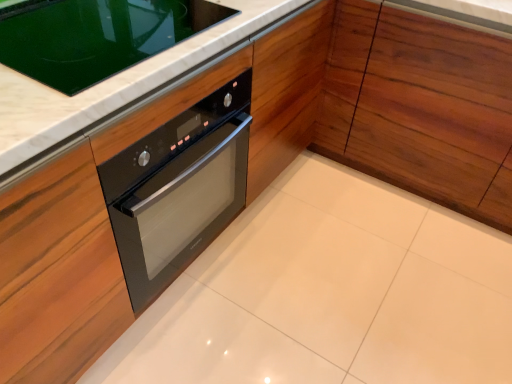
Question: Does wooden cabinet at center appear on the right side of black glass oven at upper left?

Choices:
 (A) yes
 (B) no

Answer: (A)

Question: Is wooden cabinet at center facing away from black glass oven at upper left?

Choices:
 (A) no
 (B) yes

Answer: (A)

Question: Can black glass oven at upper left be found inside wooden cabinet at center?

Choices:
 (A) yes
 (B) no

Answer: (B)

Question: Is wooden cabinet at center closer to the viewer compared to black glass oven at upper left?

Choices:
 (A) no
 (B) yes

Answer: (A)

Question: Does wooden cabinet at center have a lesser height compared to black glass oven at upper left?

Choices:
 (A) yes
 (B) no

Answer: (B)

Question: Is wooden cabinet at center located outside black glass oven at upper left?

Choices:
 (A) no
 (B) yes

Answer: (B)

Question: Would you say black glass oven at upper left is a long distance from wooden cabinet at center?

Choices:
 (A) no
 (B) yes

Answer: (A)

Question: Is black glass oven at upper left behind wooden cabinet at center?

Choices:
 (A) yes
 (B) no

Answer: (B)

Question: Is black glass oven at upper left facing away from wooden cabinet at center?

Choices:
 (A) yes
 (B) no

Answer: (B)

Question: From the image's perspective, does black glass oven at upper left appear lower than wooden cabinet at center?

Choices:
 (A) yes
 (B) no

Answer: (A)

Question: Considering the relative sizes of black glass oven at upper left and wooden cabinet at center in the image provided, is black glass oven at upper left taller than wooden cabinet at center?

Choices:
 (A) yes
 (B) no

Answer: (B)

Question: Does black glass oven at upper left have a greater width compared to wooden cabinet at center?

Choices:
 (A) no
 (B) yes

Answer: (A)

Question: Based on their sizes in the image, would you say wooden cabinet at center is bigger or smaller than black glass oven at upper left?

Choices:
 (A) big
 (B) small

Answer: (A)